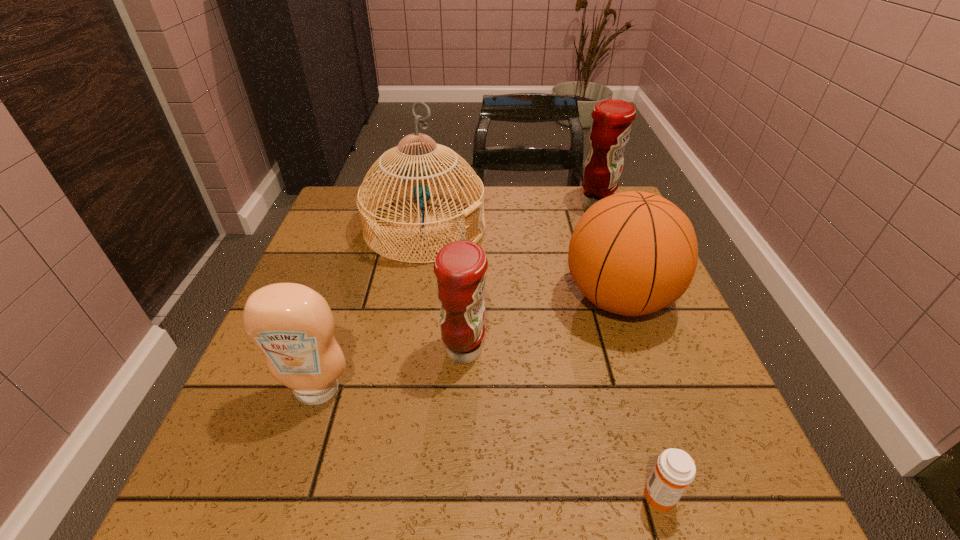
This screenshot has width=960, height=540. Identify the location of basketball that is at the right edge. (632, 253).

Find the location of a particular element. The image size is (960, 540). medicine present at the right edge is located at coordinates (675, 469).

The width and height of the screenshot is (960, 540). Identify the location of object at the far left corner. (414, 170).

This screenshot has height=540, width=960. I want to click on object that is positioned at the far right corner, so click(x=612, y=119).

This screenshot has width=960, height=540. In order to click on object located in the near right corner section of the desktop in this screenshot , I will do `click(675, 469)`.

In the image, there is a desktop. Where is `vacant space at the far edge`? This screenshot has height=540, width=960. vacant space at the far edge is located at coordinates (519, 192).

Where is `vacant space at the left edge of the desktop`? Image resolution: width=960 pixels, height=540 pixels. vacant space at the left edge of the desktop is located at coordinates (306, 259).

In order to click on free region at the right edge of the desktop in this screenshot , I will do `click(681, 347)`.

The height and width of the screenshot is (540, 960). What are the coordinates of `vacant region at the far right corner` in the screenshot? It's located at (575, 207).

The image size is (960, 540). In the image, there is a desktop. In order to click on free region at the near right corner in this screenshot , I will do 713,464.